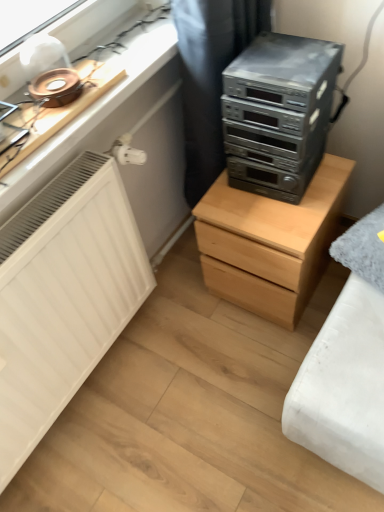
Question: Is black fabric curtain at upper center at the left side of satin black stereo at upper right?

Choices:
 (A) no
 (B) yes

Answer: (B)

Question: From the image's perspective, is black fabric curtain at upper center under satin black stereo at upper right?

Choices:
 (A) yes
 (B) no

Answer: (B)

Question: From the image's perspective, is black fabric curtain at upper center located above satin black stereo at upper right?

Choices:
 (A) yes
 (B) no

Answer: (A)

Question: Is black fabric curtain at upper center bigger than satin black stereo at upper right?

Choices:
 (A) no
 (B) yes

Answer: (B)

Question: From a real-world perspective, is black fabric curtain at upper center positioned over satin black stereo at upper right based on gravity?

Choices:
 (A) no
 (B) yes

Answer: (A)

Question: From their relative heights in the image, would you say satin black stereo at upper right is taller or shorter than black fabric curtain at upper center?

Choices:
 (A) short
 (B) tall

Answer: (A)

Question: In the image, is satin black stereo at upper right positioned in front of or behind black fabric curtain at upper center?

Choices:
 (A) front
 (B) behind

Answer: (A)

Question: Considering the positions of satin black stereo at upper right and black fabric curtain at upper center in the image, is satin black stereo at upper right bigger or smaller than black fabric curtain at upper center?

Choices:
 (A) big
 (B) small

Answer: (B)

Question: From a real-world perspective, is satin black stereo at upper right physically located above or below black fabric curtain at upper center?

Choices:
 (A) below
 (B) above

Answer: (B)

Question: Is light wood chest of drawers at center wider or thinner than black fabric curtain at upper center?

Choices:
 (A) wide
 (B) thin

Answer: (A)

Question: In terms of height, does light wood chest of drawers at center look taller or shorter compared to black fabric curtain at upper center?

Choices:
 (A) tall
 (B) short

Answer: (B)

Question: Relative to black fabric curtain at upper center, is light wood chest of drawers at center in front or behind?

Choices:
 (A) behind
 (B) front

Answer: (A)

Question: Considering the positions of point (342, 193) and point (183, 75), is point (342, 193) closer or farther from the camera than point (183, 75)?

Choices:
 (A) closer
 (B) farther

Answer: (B)

Question: In terms of height, does black fabric curtain at upper center look taller or shorter compared to satin black stereo at upper right?

Choices:
 (A) short
 (B) tall

Answer: (B)

Question: From a real-world perspective, relative to satin black stereo at upper right, is black fabric curtain at upper center vertically above or below?

Choices:
 (A) above
 (B) below

Answer: (B)